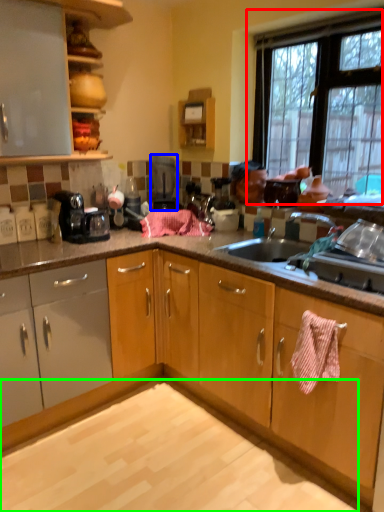
Question: Based on their relative distances, which object is nearer to window (highlighted by a red box)? Choose from kitchen appliance (highlighted by a blue box) and granite (highlighted by a green box).

Choices:
 (A) kitchen appliance
 (B) granite

Answer: (A)